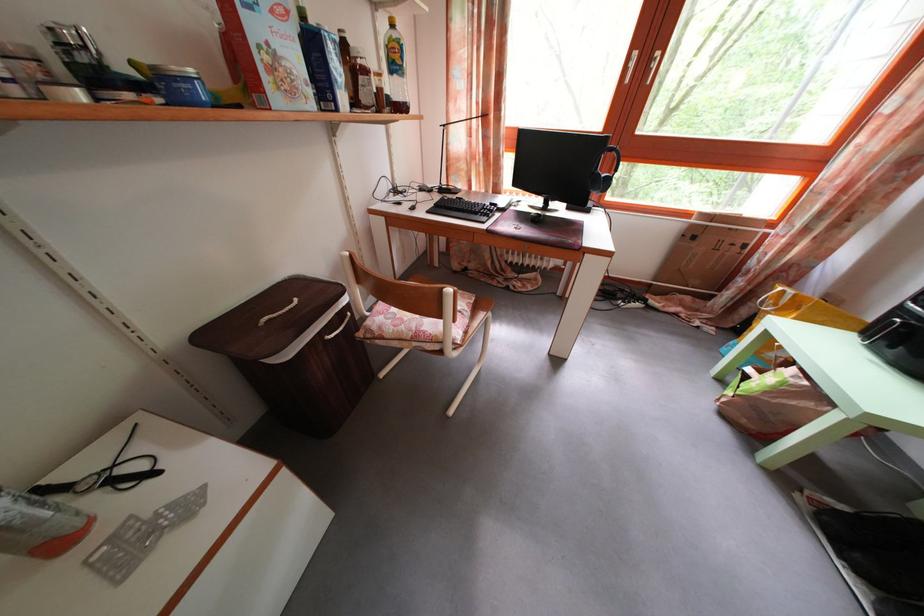
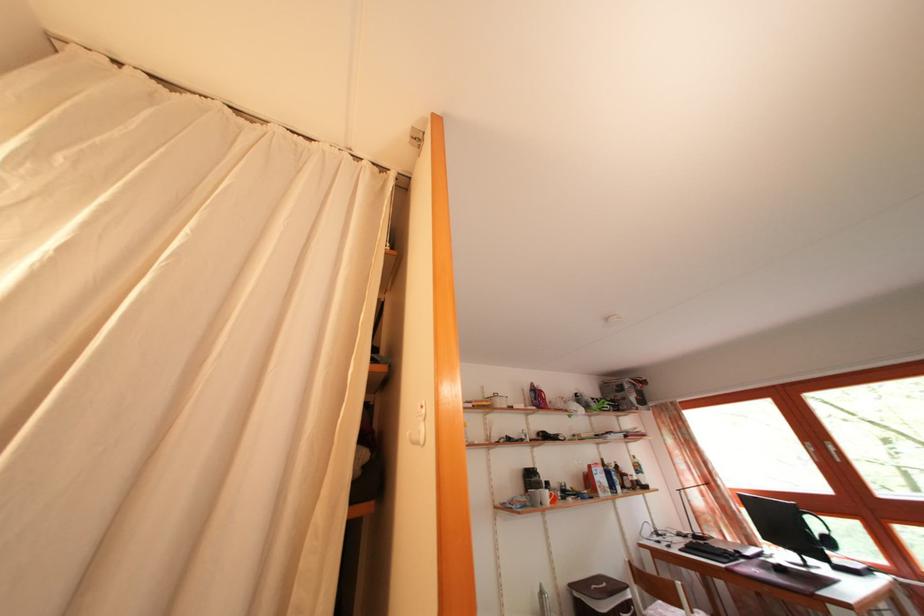
The point at (380, 74) is marked in the first image. Where is the corresponding point in the second image?

(636, 480)